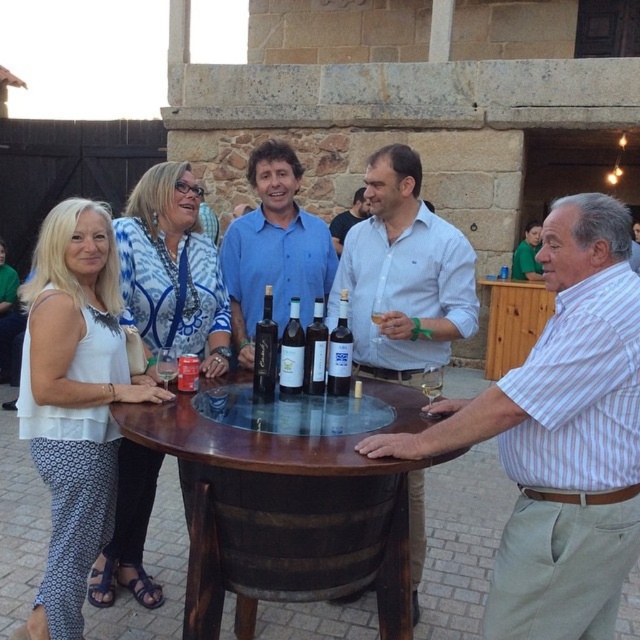
You are standing at the edge of the courtyard looking at the round wooden table. There are two points marked on the table surface at coordinates point [410,291] and point [196,381]. If you want to place a small vase between these two points so that it is closer to the one that is nearer to you, which point should the vase be placed closer to?

The vase should be placed closer to point [196,381] because it is nearer to you compared to point [410,291], which is further away.

You are a bartender at the event and need to select the taller bottle for a drink recipe. Which one should you choose between the matte glass bottles at center and the translucent glass bottle at center?

The matte glass bottles at center are taller than the translucent glass bottle at center, so you should choose the matte glass bottles at center for the drink recipe.

You are standing at the edge of the table and want to reach both point (x=332, y=392) and point (x=310, y=381). Which point is closer to you?

Point (x=310, y=381) is closer to you because it is less further away than point (x=332, y=392).